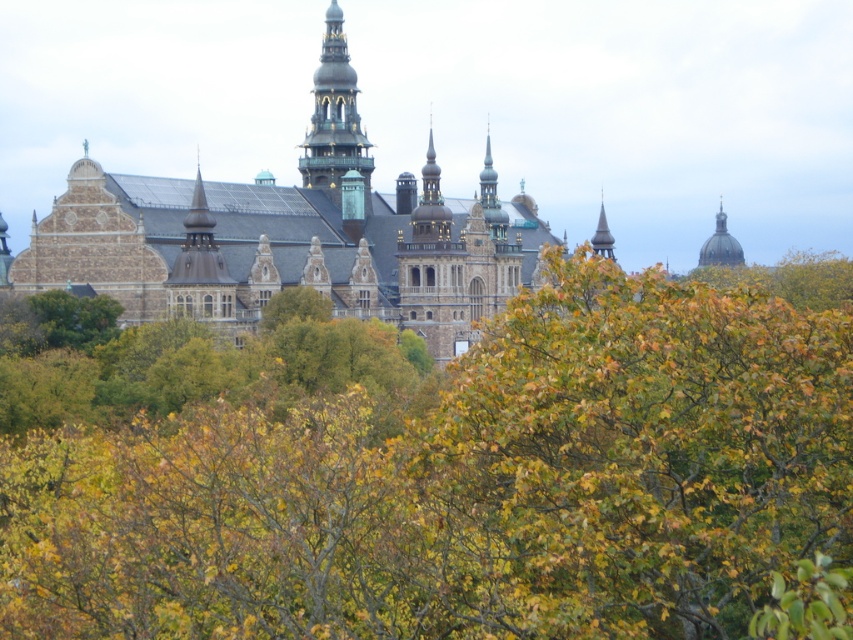
You are standing in front of the grand historic building and notice both the green leafy tree at center and the brown stone castle at center. Which object is closer to you?

The green leafy tree at center is closer because it is positioned under the brown stone castle at center, indicating it is in the foreground.

You are standing in front of the grand historic building and notice the green leafy tree at center. Based on its 2D coordinates, can you determine if it is positioned to the left or right side of the image?

The green leafy tree at center is located at point 0.738 on the x axis, which is closer to the right side of the image, so it is positioned to the right side of the image.